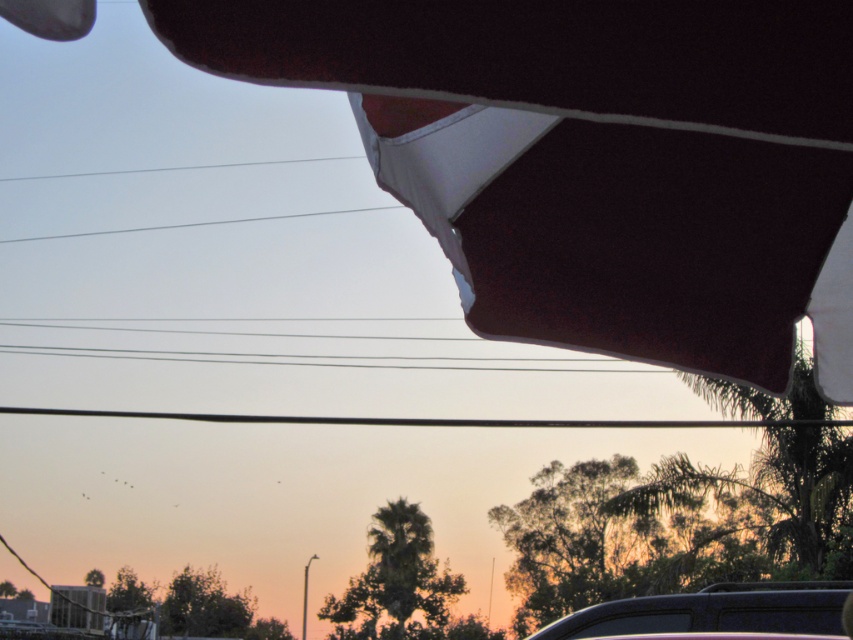
Question: Which point is farther to the camera?

Choices:
 (A) (613, 628)
 (B) (323, 211)

Answer: (B)

Question: Where is shiny black car at lower right located in relation to clear wire at upper center in the image?

Choices:
 (A) above
 (B) below

Answer: (B)

Question: Is black wire at center thinner than clear wire at upper center?

Choices:
 (A) no
 (B) yes

Answer: (A)

Question: Is black wire at center wider than clear wire at upper center?

Choices:
 (A) yes
 (B) no

Answer: (A)

Question: Which is nearer to the black wire at center?

Choices:
 (A) clear wire at upper center
 (B) shiny black car at lower right

Answer: (B)

Question: Which point appears closest to the camera in this image?

Choices:
 (A) (793, 422)
 (B) (352, 209)

Answer: (A)